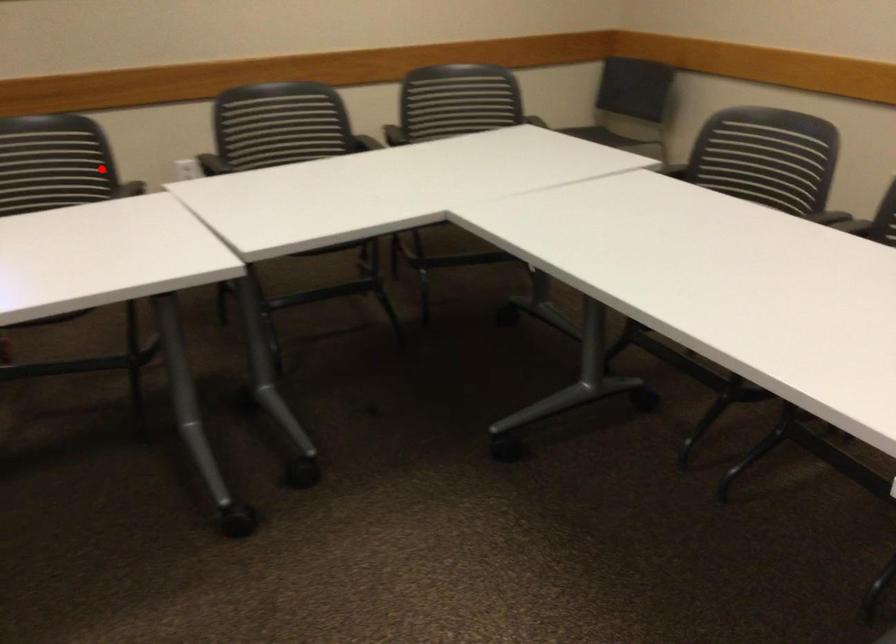
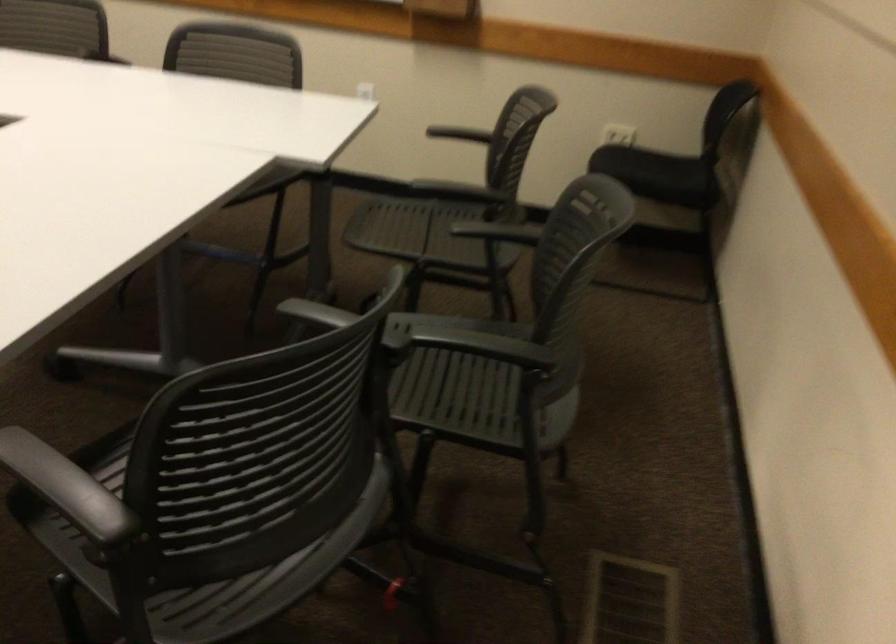
Question: A red point is marked in image1. In image2, is the corresponding 3D point closer to the camera or farther? Reply with the corresponding letter.

Choices:
 (A) The corresponding 3D point is closer.
 (B) The corresponding 3D point is farther.

Answer: (A)